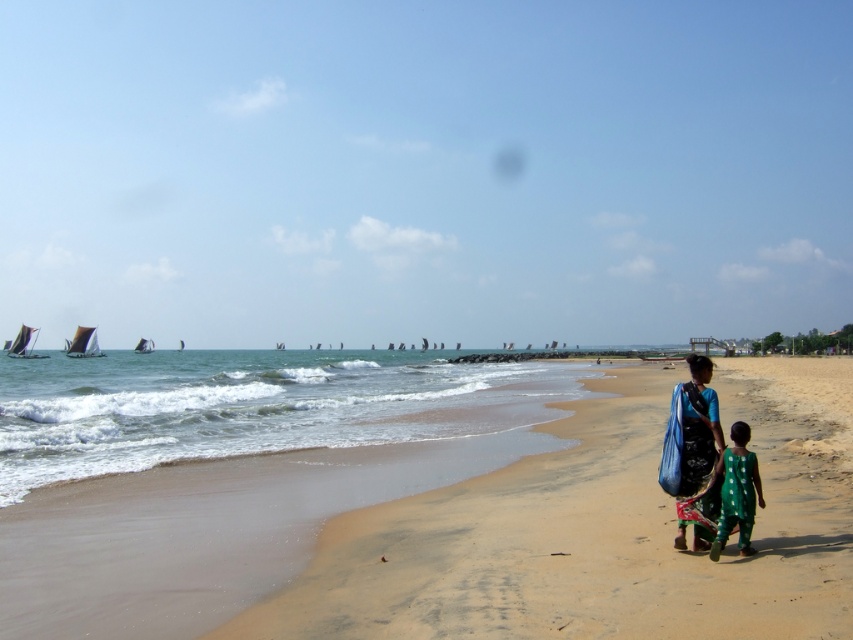
You are standing on the sandy beach at lower right. Looking towards the horizon, where are the sailboats located relative to your position?

The sailboats are located in the distance, away from the sandy beach at lower right, towards the horizon.